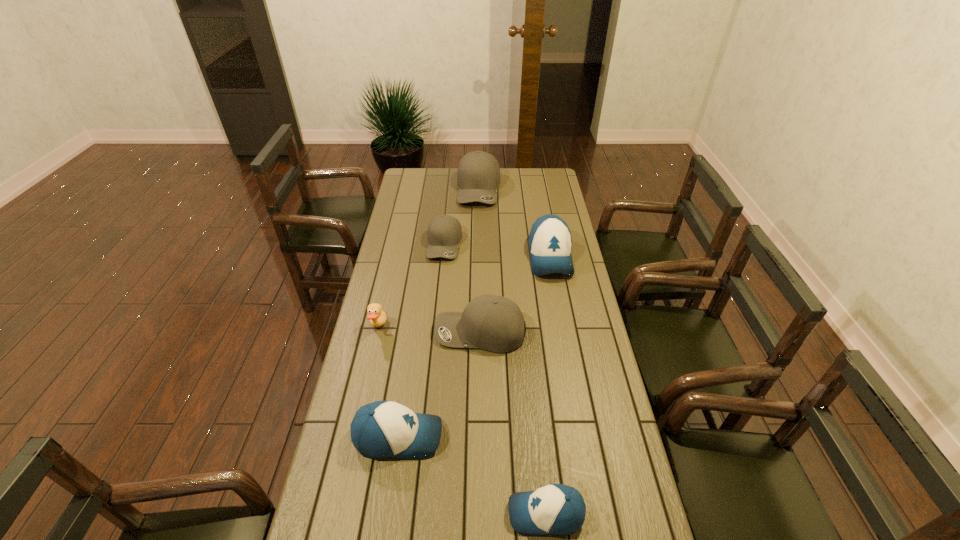
Choose which blue baseball cap is the third nearest neighbor to the smallest gray baseball cap. Please provide its 2D coordinates. Your answer should be formatted as a tuple, i.e. [(x, y)], where the tuple contains the x and y coordinates of a point satisfying the conditions above.

[(557, 509)]

At what (x,y) coordinates should I click in order to perform the action: click on blue baseball cap that is the second closest to the tan duck. Please return your answer as a coordinate pair (x, y). This screenshot has width=960, height=540. Looking at the image, I should click on (550, 242).

Find the location of a particular element. free location that satisfies the following two spatial constraints: 1. on the front-facing side of the biggest blue baseball cap; 2. on the front-facing side of the fifth farthest baseball cap is located at coordinates (584, 436).